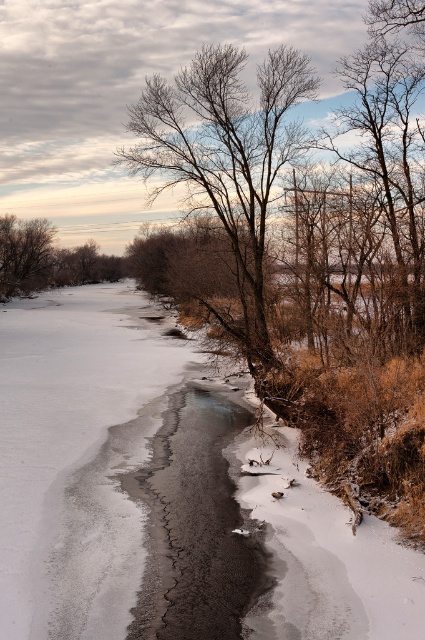
Consider the image. You are an observer standing on the riverbank. You see the bare branches at center and the brown matte tree at left. Which one is closer to your right side?

The bare branches at center is to the right of brown matte tree at left, so the bare branches at center is closer to your right side.

You are standing at the edge of the frozen river and see two points marked on the ice. The first point is at coordinates point (178, 273) and the second point is at point (2, 228). Which point is closer to you?

Point (178, 273) is closer to the camera than point (2, 228), so the first point is closer to you.